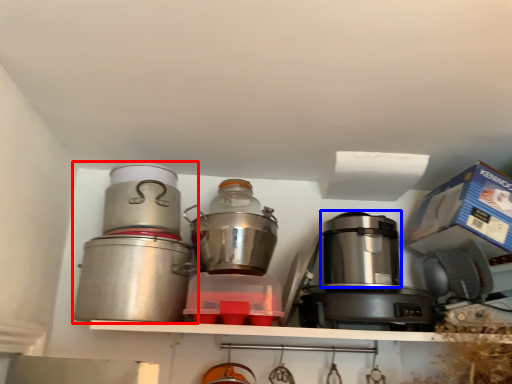
Question: Which object appears farthest to the camera in this image, kitchen appliance (highlighted by a red box) or appliance (highlighted by a blue box)?

Choices:
 (A) kitchen appliance
 (B) appliance

Answer: (B)